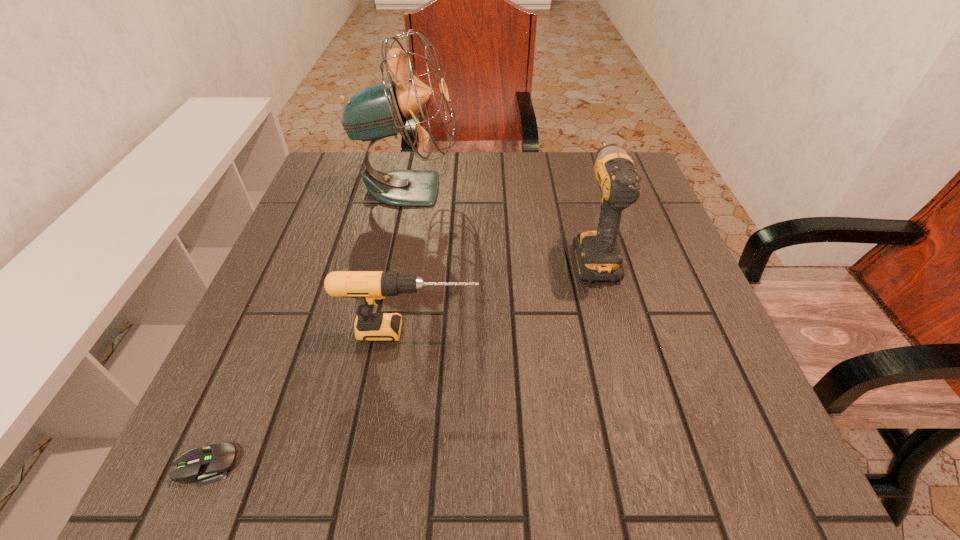
Find the location of a particular element. Image resolution: width=960 pixels, height=540 pixels. object located in the near left corner section of the desktop is located at coordinates (210, 464).

Where is `vacant space at the far edge`? The image size is (960, 540). vacant space at the far edge is located at coordinates (518, 174).

Where is `vacant area at the near edge`? vacant area at the near edge is located at coordinates (650, 467).

Locate an element on the screen. vacant space at the left edge of the desktop is located at coordinates click(267, 327).

In the image, there is a desktop. Where is `vacant region at the right edge`? Image resolution: width=960 pixels, height=540 pixels. vacant region at the right edge is located at coordinates (691, 319).

This screenshot has width=960, height=540. What are the coordinates of `free space at the far left corner of the desktop` in the screenshot? It's located at (359, 199).

Where is `free space between the second shortest object and the nearest object`? free space between the second shortest object and the nearest object is located at coordinates (309, 397).

Identify the location of empty space that is in between the fan and the farther drill. The width and height of the screenshot is (960, 540). (500, 221).

The image size is (960, 540). In order to click on free space between the farthest object and the second farthest object in this screenshot , I will do `click(500, 221)`.

Where is `blank region between the shortest object and the third tallest object`? blank region between the shortest object and the third tallest object is located at coordinates (309, 397).